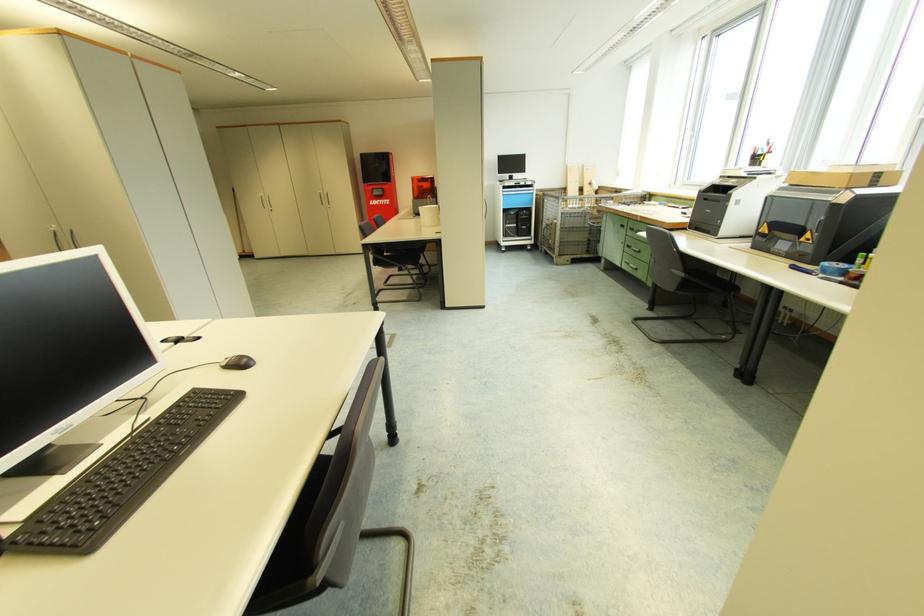
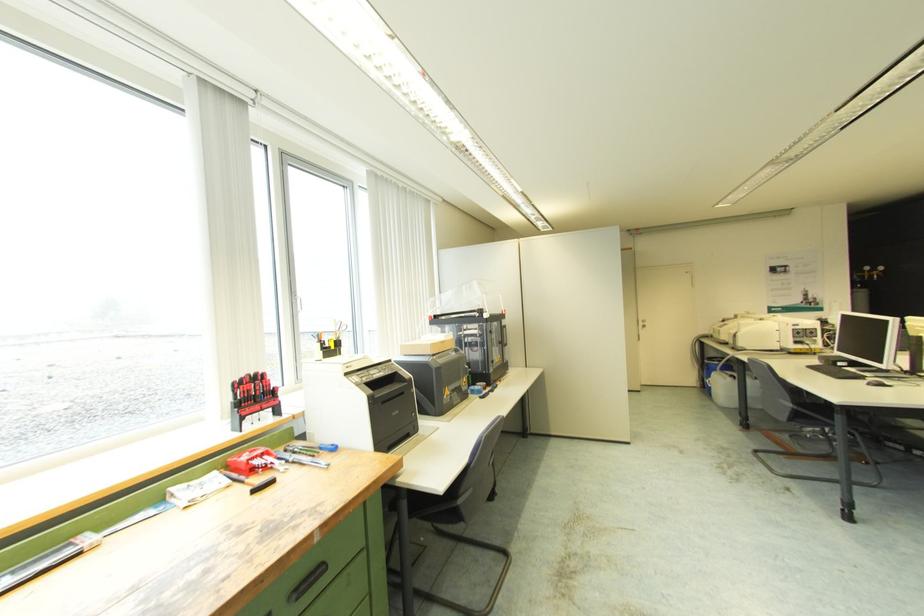
Where in the second image is the point corresponding to the point at 723,201 from the first image?

(407, 394)